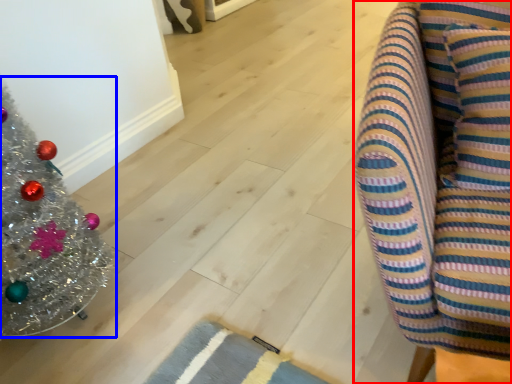
Question: Among these objects, which one is nearest to the camera, furniture (highlighted by a red box) or christmas tree (highlighted by a blue box)?

Choices:
 (A) furniture
 (B) christmas tree

Answer: (A)